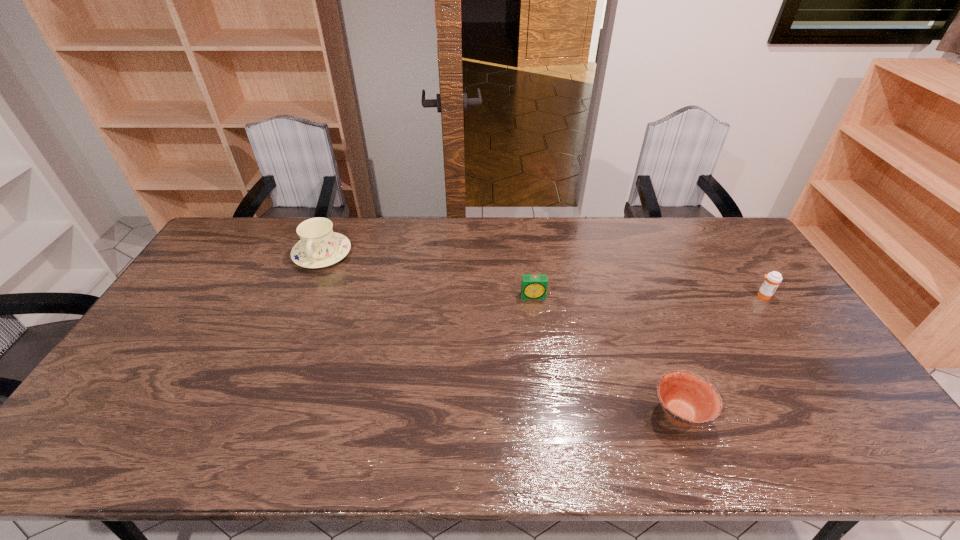
Find the location of `empty space that is in between the rightmost object and the alarm clock`. empty space that is in between the rightmost object and the alarm clock is located at coordinates (648, 296).

Locate an element on the screen. The image size is (960, 540). free spot between the medicine and the third object from right to left is located at coordinates (648, 296).

Where is `vacant area that lies between the chinaware and the alarm clock`? vacant area that lies between the chinaware and the alarm clock is located at coordinates (428, 275).

Locate an element on the screen. vacant area between the medicine and the second object from left to right is located at coordinates (648, 296).

Find the location of a particular element. This screenshot has height=540, width=960. vacant space that's between the leftmost object and the medicine is located at coordinates (542, 275).

At what (x,y) coordinates should I click in order to perform the action: click on empty space between the leftmost object and the rightmost object. Please return your answer as a coordinate pair (x, y). Looking at the image, I should click on (542, 275).

The image size is (960, 540). I want to click on object that can be found as the third closest to the alarm clock, so click(x=773, y=279).

Where is `object that ranks as the closest to the third object from left to right`? This screenshot has width=960, height=540. object that ranks as the closest to the third object from left to right is located at coordinates (533, 287).

Locate an element on the screen. The height and width of the screenshot is (540, 960). free space that satisfies the following two spatial constraints: 1. on the handle side of the farthest object; 2. on the left side of the second object from right to left is located at coordinates (255, 413).

The width and height of the screenshot is (960, 540). Find the location of `free space that satisfies the following two spatial constraints: 1. on the handle side of the farthest object; 2. on the right side of the medicine`. free space that satisfies the following two spatial constraints: 1. on the handle side of the farthest object; 2. on the right side of the medicine is located at coordinates (304, 295).